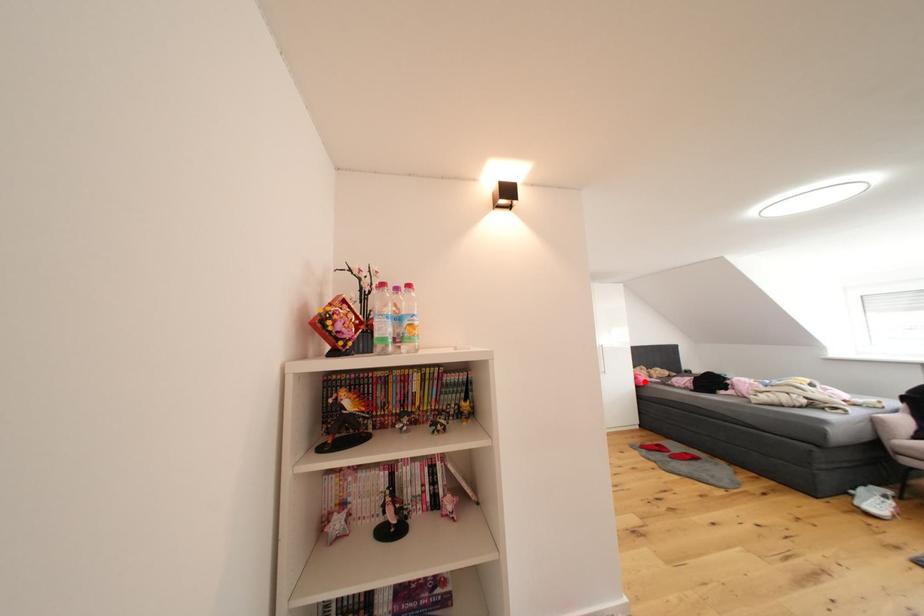
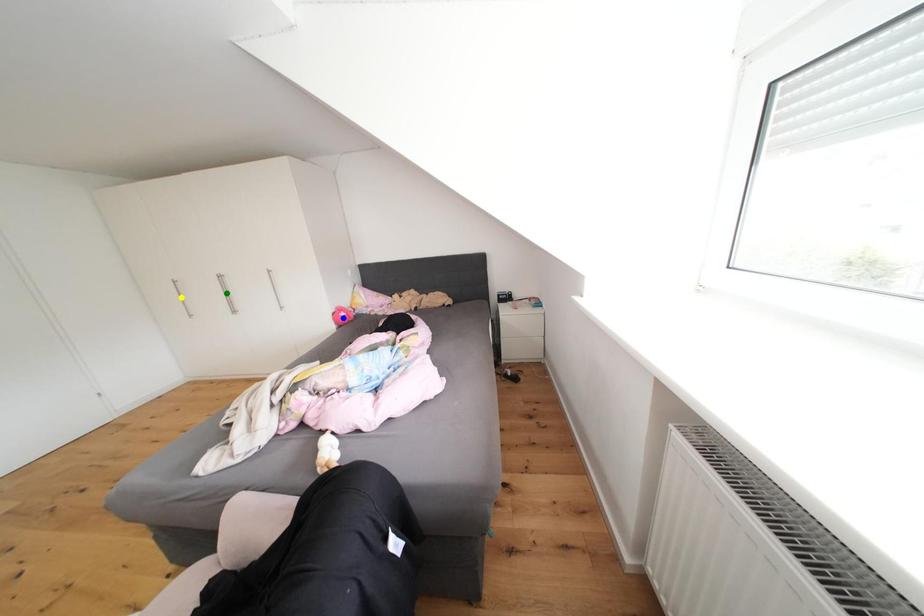
Question: I am providing you with two images of the same scene from different viewpoints. A red point is marked on the first image. You are given multiple points on the second image. Which point in image 2 is actually the same real-world point as the red point in image 1?

Choices:
 (A) yellow point
 (B) green point
 (C) blue point

Answer: (C)